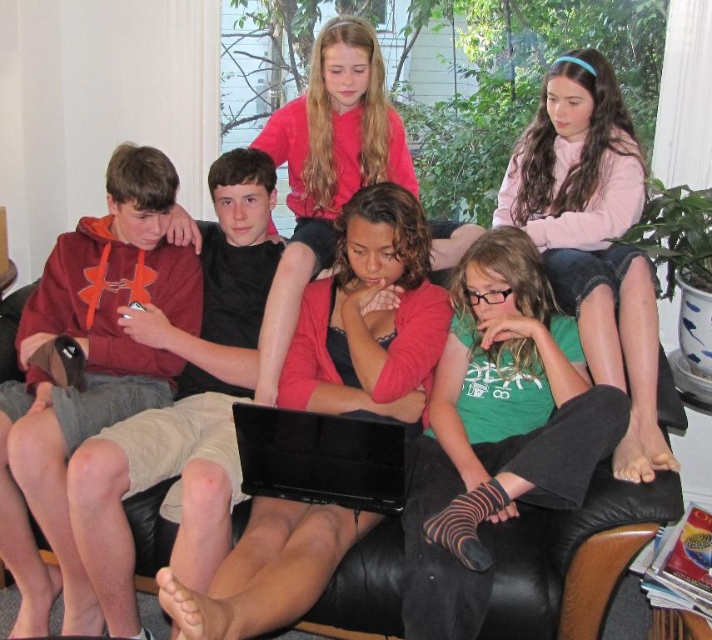
Question: Estimate the real-world distances between objects in this image. Which object is farther from the matte pink sweater at center?

Choices:
 (A) black glossy laptop at center
 (B) pink fleece jacket at upper right
 (C) matte black laptop at center
 (D) black leather couch at center

Answer: (D)

Question: Is matte pink sweater at center bigger than black glossy laptop at center?

Choices:
 (A) yes
 (B) no

Answer: (A)

Question: Estimate the real-world distances between objects in this image. Which object is closer to the matte pink sweater at center?

Choices:
 (A) black leather couch at center
 (B) pink fleece jacket at upper right
 (C) black glossy laptop at center

Answer: (C)

Question: Can you confirm if matte black laptop at center is positioned below pink fleece jacket at upper right?

Choices:
 (A) no
 (B) yes

Answer: (B)

Question: Which of the following is the farthest from the observer?

Choices:
 (A) black glossy laptop at center
 (B) pink fleece jacket at upper right

Answer: (B)

Question: In this image, where is black leather couch at center located relative to matte pink sweater at center?

Choices:
 (A) below
 (B) above

Answer: (A)